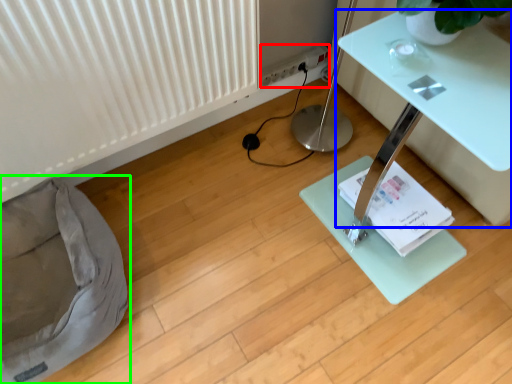
Question: Based on their relative distances, which object is nearer to electric outlet (highlighted by a red box)? Choose from table (highlighted by a blue box) and bean bag chair (highlighted by a green box).

Choices:
 (A) table
 (B) bean bag chair

Answer: (A)